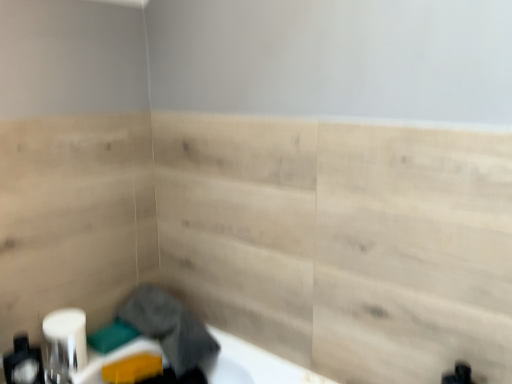
The width and height of the screenshot is (512, 384). Identify the location of matte white soap dispenser at lower left. (23, 362).

Where is `white glossy toilet paper at lower left`? The height and width of the screenshot is (384, 512). white glossy toilet paper at lower left is located at coordinates (65, 342).

The width and height of the screenshot is (512, 384). Identify the location of natural wood paneling at center. (270, 234).

The height and width of the screenshot is (384, 512). What do you see at coordinates (168, 327) in the screenshot? I see `gray fabric at lower left` at bounding box center [168, 327].

Identify the location of matte white soap dispenser at lower left. (23, 362).

Considering the relative sizes of matte white soap dispenser at lower left and natural wood paneling at center in the image provided, is matte white soap dispenser at lower left taller than natural wood paneling at center?

No.

Looking at the image, does matte white soap dispenser at lower left seem bigger or smaller compared to natural wood paneling at center?

Considering their sizes, matte white soap dispenser at lower left takes up less space than natural wood paneling at center.

Which object is wider, matte white soap dispenser at lower left or natural wood paneling at center?

matte white soap dispenser at lower left.

From a real-world perspective, who is located lower, natural wood paneling at center or matte white soap dispenser at lower left?

From a 3D spatial view, matte white soap dispenser at lower left is below.

Is natural wood paneling at center in front of matte white soap dispenser at lower left?

Yes, the depth of natural wood paneling at center is less than that of matte white soap dispenser at lower left.

Does point (120, 240) lie behind point (35, 360)?

Yes.

Which of these two, natural wood paneling at center or matte white soap dispenser at lower left, is thinner?

natural wood paneling at center.

Consider the image. From a real-world perspective, is matte white soap dispenser at lower left above or below white glossy toilet paper at lower left?

Clearly, from a real-world perspective, matte white soap dispenser at lower left is above white glossy toilet paper at lower left.

Does matte white soap dispenser at lower left have a smaller size compared to white glossy toilet paper at lower left?

No.

Which is more to the right, matte white soap dispenser at lower left or white glossy toilet paper at lower left?

white glossy toilet paper at lower left.

How different are the orientations of white glossy toilet paper at lower left and natural wood paneling at center in degrees?

89.2 degrees.

From a real-world perspective, is white glossy toilet paper at lower left physically above natural wood paneling at center?

Incorrect, from a real-world perspective, white glossy toilet paper at lower left is lower than natural wood paneling at center.

Could you tell me if white glossy toilet paper at lower left is turned towards natural wood paneling at center?

No, white glossy toilet paper at lower left is not turned towards natural wood paneling at center.

Are natural wood paneling at center and white glossy toilet paper at lower left far apart?

natural wood paneling at center is near white glossy toilet paper at lower left, not far away.

Image resolution: width=512 pixels, height=384 pixels. I want to click on plywood in front of the white glossy toilet paper at lower left, so click(270, 234).

From the image's perspective, is natural wood paneling at center above or below white glossy toilet paper at lower left?

Based on their image positions, natural wood paneling at center is located above white glossy toilet paper at lower left.

Looking at this image, who is smaller, natural wood paneling at center or white glossy toilet paper at lower left?

With smaller size is white glossy toilet paper at lower left.

Consider the image. Does white glossy toilet paper at lower left lie behind matte white soap dispenser at lower left?

That is True.

From a real-world perspective, is white glossy toilet paper at lower left physically above matte white soap dispenser at lower left?

No, from a real-world perspective, white glossy toilet paper at lower left is not above matte white soap dispenser at lower left.

Considering the relative sizes of white glossy toilet paper at lower left and matte white soap dispenser at lower left in the image provided, is white glossy toilet paper at lower left smaller than matte white soap dispenser at lower left?

Indeed, white glossy toilet paper at lower left has a smaller size compared to matte white soap dispenser at lower left.

How many degrees apart are the facing directions of white glossy toilet paper at lower left and matte white soap dispenser at lower left?

They differ by 0.00102 degrees in their facing directions.

Which point is more forward, [22,333] or [182,322]?

The point [22,333] is closer.

From the image's perspective, is matte white soap dispenser at lower left positioned above or below gray fabric at lower left?

Clearly, from the image's perspective, matte white soap dispenser at lower left is below gray fabric at lower left.

Between matte white soap dispenser at lower left and gray fabric at lower left, which one is positioned behind?

gray fabric at lower left is further from the camera.

Where is `toiletry in front of the gray fabric at lower left`? The width and height of the screenshot is (512, 384). toiletry in front of the gray fabric at lower left is located at coordinates (23, 362).

Locate an element on the screen. The height and width of the screenshot is (384, 512). plywood above the matte white soap dispenser at lower left (from a real-world perspective) is located at coordinates (270, 234).

Find the location of `toiletry below the natural wood paneling at center (from the image's perspective)`. toiletry below the natural wood paneling at center (from the image's perspective) is located at coordinates (23, 362).

Which object lies nearer to the anchor point natural wood paneling at center, matte white soap dispenser at lower left or gray fabric at lower left?

The object closer to natural wood paneling at center is gray fabric at lower left.

Based on their spatial positions, is natural wood paneling at center or gray fabric at lower left closer to matte white soap dispenser at lower left?

gray fabric at lower left.

Based on their spatial positions, is natural wood paneling at center or matte white soap dispenser at lower left closer to white glossy toilet paper at lower left?

Among the two, matte white soap dispenser at lower left is located nearer to white glossy toilet paper at lower left.

Looking at the image, which one is located closer to natural wood paneling at center, gray fabric at lower left or matte white soap dispenser at lower left?

gray fabric at lower left is closer to natural wood paneling at center.

Based on their spatial positions, is matte white soap dispenser at lower left or gray fabric at lower left closer to white glossy toilet paper at lower left?

The object closer to white glossy toilet paper at lower left is matte white soap dispenser at lower left.

Considering their positions, is natural wood paneling at center positioned closer to gray fabric at lower left than white glossy toilet paper at lower left?

white glossy toilet paper at lower left is closer to gray fabric at lower left.

Which object lies further to the anchor point matte white soap dispenser at lower left, gray fabric at lower left or natural wood paneling at center?

natural wood paneling at center is further to matte white soap dispenser at lower left.

Looking at the image, which one is located closer to matte white soap dispenser at lower left, gray fabric at lower left or white glossy toilet paper at lower left?

white glossy toilet paper at lower left is positioned closer to the anchor matte white soap dispenser at lower left.

Identify the location of toilet paper situated between matte white soap dispenser at lower left and gray fabric at lower left from left to right. This screenshot has width=512, height=384. (65, 342).

Locate an element on the screen. laundry situated between matte white soap dispenser at lower left and natural wood paneling at center from left to right is located at coordinates (168, 327).

Locate an element on the screen. This screenshot has height=384, width=512. toilet paper between matte white soap dispenser at lower left and natural wood paneling at center is located at coordinates (65, 342).

Identify the location of laundry between white glossy toilet paper at lower left and natural wood paneling at center. The image size is (512, 384). (168, 327).